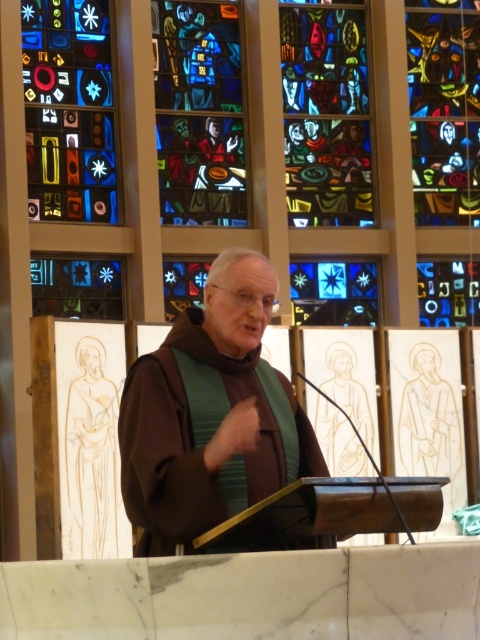
You are an architect designing a new church layout. You need to place a microphone stand exactly at point [214,422] where the brown velvety robe at center is located. Is there enough space for the microphone stand at that point?

The point [214,422] is occupied by the brown velvety robe at center, so placing the microphone stand there would not be possible as the robe is already present at that location.

You are an attendee sitting in the front pew of the church. You see the brown velvety robe at center and the stained glass window at center. Which object is nearer to you?

The brown velvety robe at center is closer to the viewer than the stained glass window at center, so the brown velvety robe at center is nearer to you.

Looking at this image, you are an interior designer planning to add a new decorative panel to the wall between the brown velvety robe at center and the multicolored stained glass at upper right. Based on their positions, which object will the new panel be closer to?

The new panel will be closer to the multicolored stained glass at upper right because the brown velvety robe at center is positioned on the left side of it.